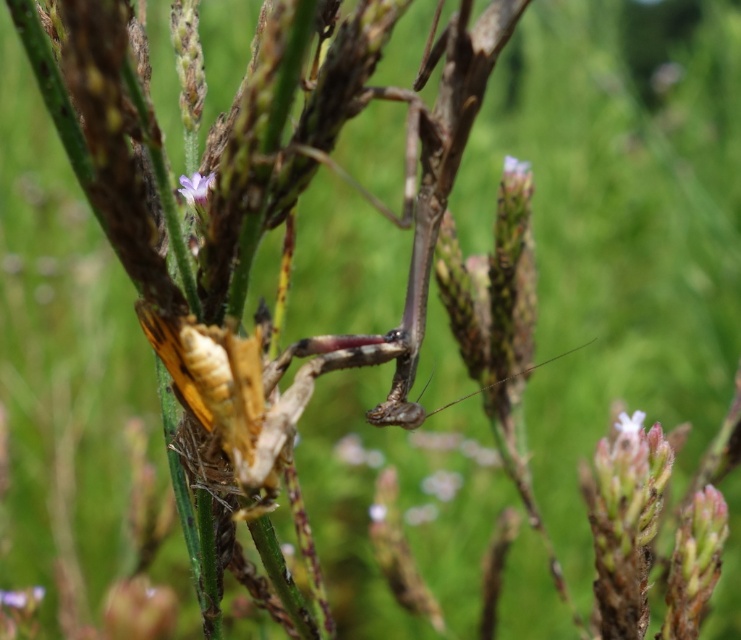
Does purple matte flower at upper center have a lesser width compared to smooth white flower at upper center?

In fact, purple matte flower at upper center might be wider than smooth white flower at upper center.

Between point (207, 193) and point (525, 168), which one is positioned behind?

Positioned behind is point (525, 168).

What do you see at coordinates (196, 188) in the screenshot?
I see `purple matte flower at upper center` at bounding box center [196, 188].

You are a GUI agent. You are given a task and a screenshot of the screen. Output one action in this format:
    pyautogui.click(x=<x>, y=<y>)
    Task: Click on the purple matte flower at upper center
    The image size is (741, 640).
    Given the screenshot: What is the action you would take?
    pyautogui.click(x=196, y=188)

In the scene shown: Is purple matte flower at center behind smooth white flower at upper center?

No, it is not.

Can you confirm if purple matte flower at center is taller than smooth white flower at upper center?

Correct, purple matte flower at center is much taller as smooth white flower at upper center.

I want to click on purple matte flower at center, so click(628, 422).

Who is more forward, (186, 195) or (619, 417)?

Point (186, 195) is more forward.

This screenshot has width=741, height=640. Describe the element at coordinates (196, 188) in the screenshot. I see `purple matte flower at upper center` at that location.

At what (x,y) coordinates should I click in order to perform the action: click on purple matte flower at upper center. Please return your answer as a coordinate pair (x, y). The height and width of the screenshot is (640, 741). Looking at the image, I should click on (196, 188).